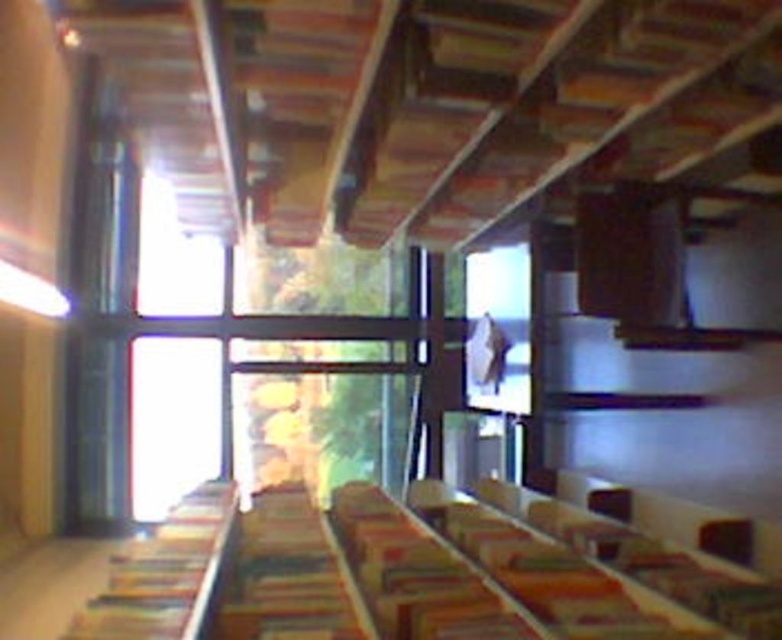
Consider the image. You are organizing a book display in the modern building. You have a multicolored fabric book at center and a hardcover book at left. If you want to place them side by side on a shelf that is 10 inches wide, will they fit together?

The multicolored fabric book at center is 7.96 inches from the hardcover book at left. Since the total distance between them is less than the shelf width of 10 inches, they can fit side by side on the shelf.

You are standing in the modern building and want to move from the point at coordinates point (255, 584) to the point at coordinates point (156, 557). Which direction should you move in to reach your destination?

To move from point (255, 584) to point (156, 557), you should move forward since point (255, 584) is behind point (156, 557).